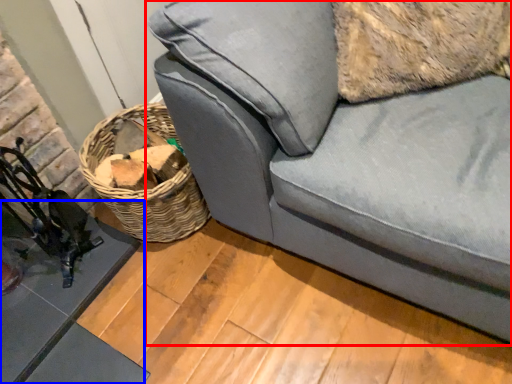
Question: Which of the following is the farthest to the observer, studio couch (highlighted by a red box) or table (highlighted by a blue box)?

Choices:
 (A) studio couch
 (B) table

Answer: (B)